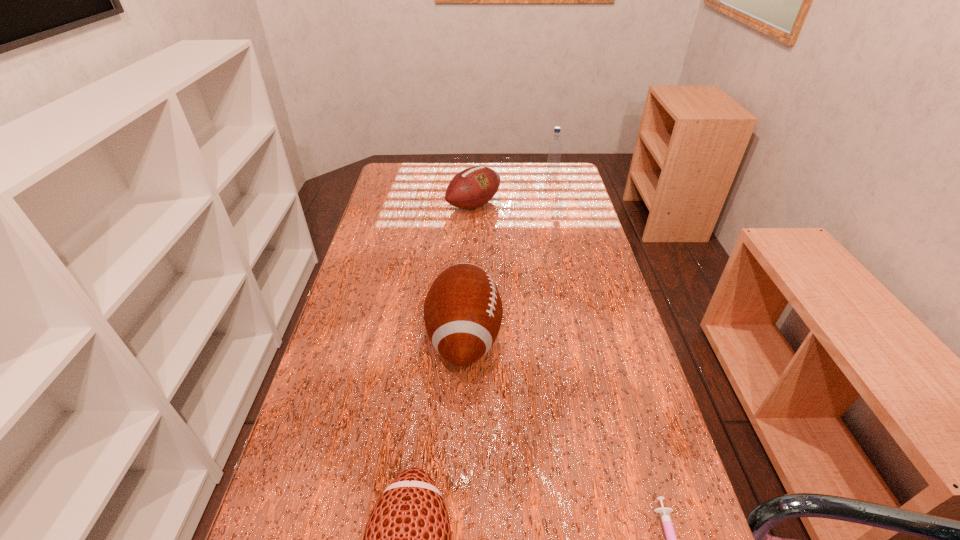
The image size is (960, 540). In order to click on object at the right edge in this screenshot , I will do `click(555, 146)`.

Image resolution: width=960 pixels, height=540 pixels. Find the location of `object that is at the far right corner`. object that is at the far right corner is located at coordinates (555, 146).

Identify the location of free spot at the far edge of the desktop. (440, 181).

At what (x,y) coordinates should I click in order to perform the action: click on vacant space at the left edge of the desktop. Please return your answer as a coordinate pair (x, y). This screenshot has width=960, height=540. Looking at the image, I should click on (390, 218).

This screenshot has height=540, width=960. In order to click on vacant space at the right edge in this screenshot , I will do `click(612, 443)`.

The height and width of the screenshot is (540, 960). What are the coordinates of `vacant area at the far left corner` in the screenshot? It's located at (393, 166).

This screenshot has width=960, height=540. Identify the location of vacant space at the far right corner of the desktop. (x=534, y=170).

Where is `empty location between the water bottle and the farthest football`? This screenshot has height=540, width=960. empty location between the water bottle and the farthest football is located at coordinates (513, 191).

Locate an element on the screen. The height and width of the screenshot is (540, 960). free space between the fourth nearest object and the second object from right to left is located at coordinates (513, 191).

Locate which object ranks third in proximity to the nearest football. Please provide its 2D coordinates. Your answer should be formatted as a tuple, i.e. [(x, y)], where the tuple contains the x and y coordinates of a point satisfying the conditions above.

[(473, 187)]